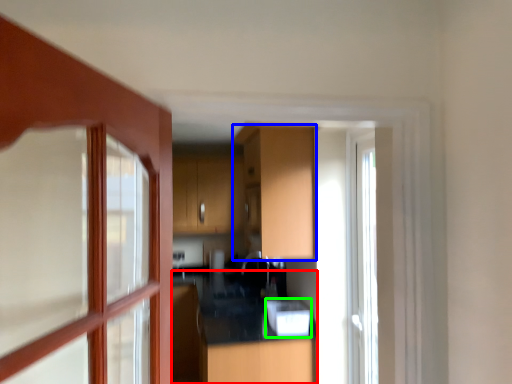
Question: Estimate the real-world distances between objects in this image. Which object is farther from counter top (highlighted by a red box), cabinetry (highlighted by a blue box) or appliance (highlighted by a green box)?

Choices:
 (A) cabinetry
 (B) appliance

Answer: (A)